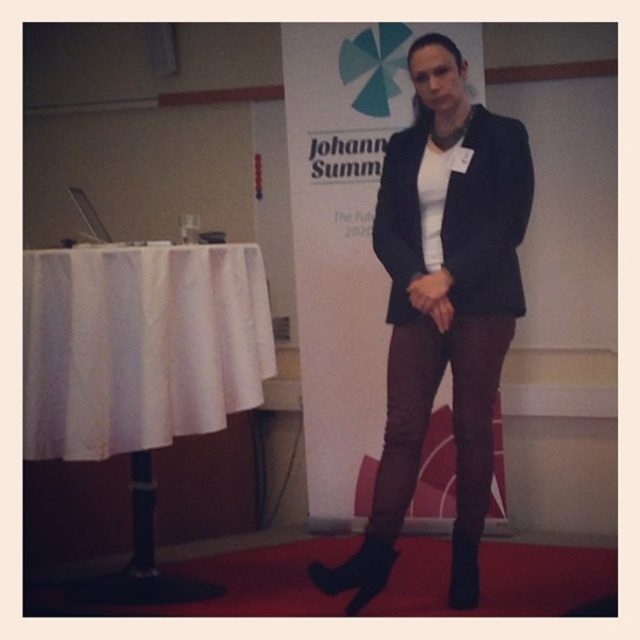
Question: Is black matte blazer at center to the left of white cloth at left from the viewer's perspective?

Choices:
 (A) no
 (B) yes

Answer: (A)

Question: Does black matte blazer at center have a larger size compared to white cloth at left?

Choices:
 (A) yes
 (B) no

Answer: (A)

Question: Which point is closer to the camera?

Choices:
 (A) (259, 356)
 (B) (474, 540)

Answer: (B)

Question: Which object is closer to the camera taking this photo?

Choices:
 (A) black matte blazer at center
 (B) white cloth at left

Answer: (B)

Question: Where is black matte blazer at center located in relation to white cloth at left in the image?

Choices:
 (A) below
 (B) above

Answer: (B)